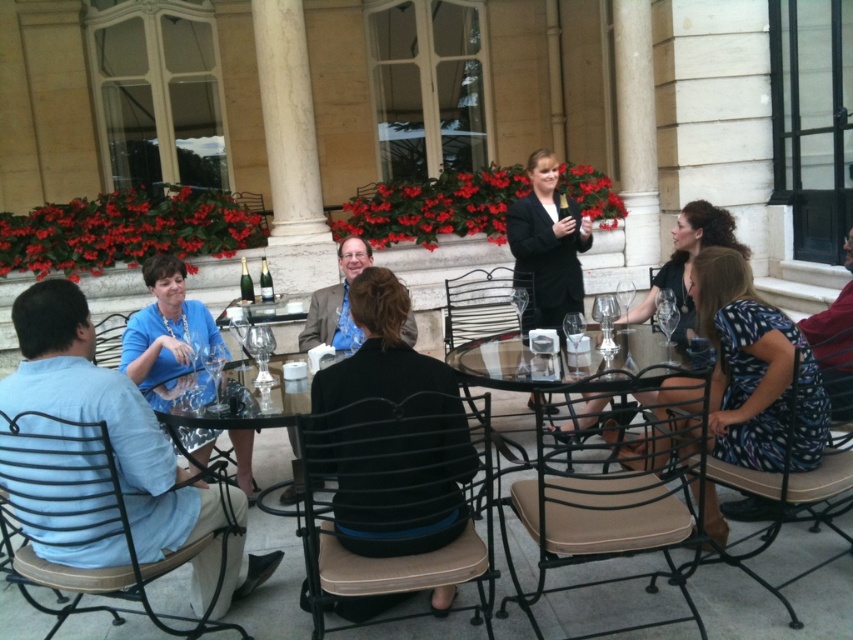
Between point (128, 435) and point (339, 316), which one is positioned in front?

Point (128, 435) is in front.

Who is shorter, light blue shirt at left or matte brown suit at center?

Standing shorter between the two is matte brown suit at center.

You are a GUI agent. You are given a task and a screenshot of the screen. Output one action in this format:
    pyautogui.click(x=<x>, y=<y>)
    Task: Click on the light blue shirt at left
    This screenshot has height=640, width=853.
    Given the screenshot: What is the action you would take?
    pyautogui.click(x=103, y=412)